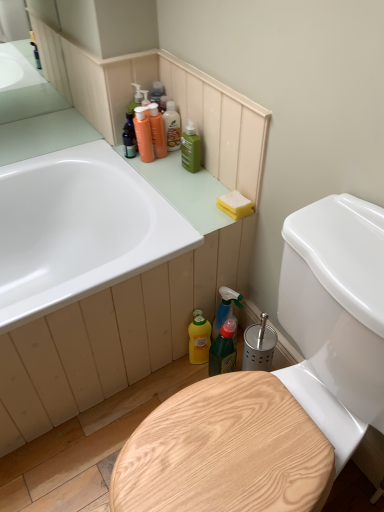
The image size is (384, 512). What are the coordinates of `free space that is to the left of translucent amber bottle at upper center, which is the sixth cleaning product from bottom to top` in the screenshot? It's located at (115, 153).